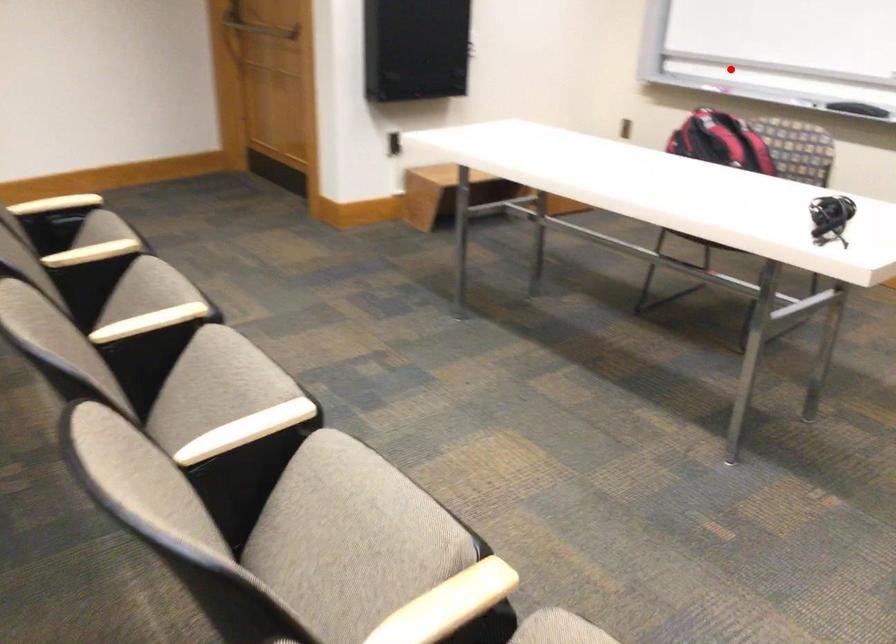
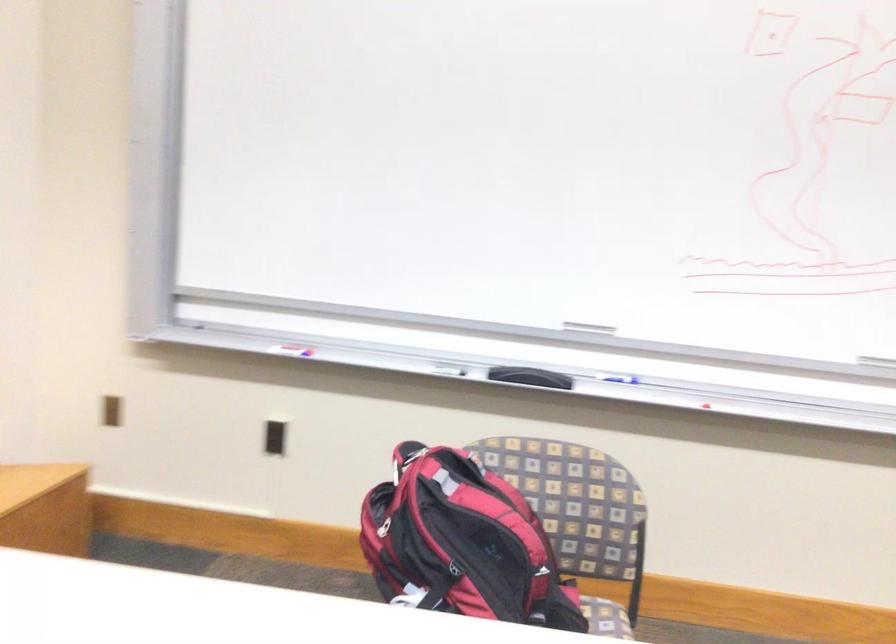
Question: I am providing you with two images of the same scene from different viewpoints. Image1 has a red point marked. In image2, the corresponding 3D location appears at what relative position? Reply with the corresponding letter.

Choices:
 (A) Closer
 (B) Farther

Answer: (A)